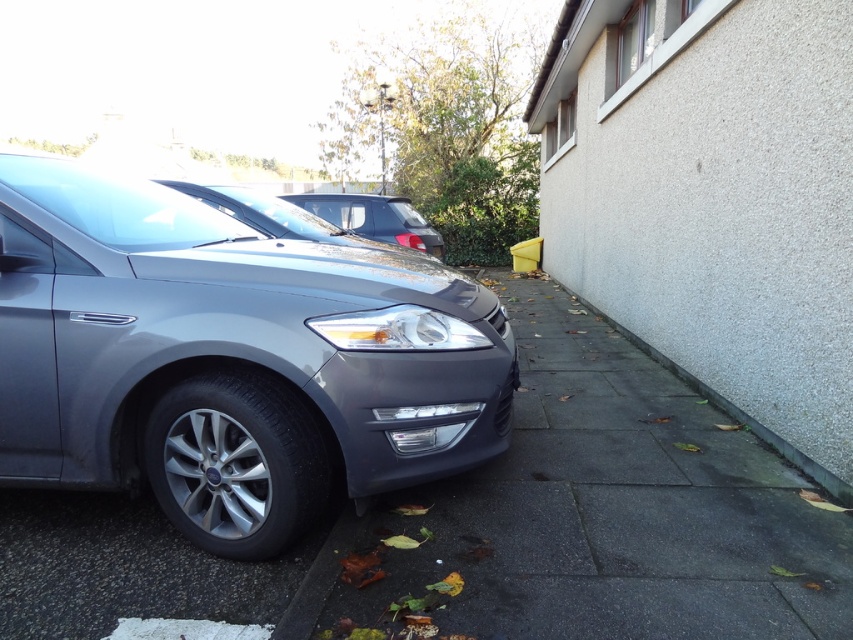
Can you confirm if satin metallic car at left is thinner than gray concrete curb at lower right?

No, satin metallic car at left is not thinner than gray concrete curb at lower right.

Identify the location of satin metallic car at left. The width and height of the screenshot is (853, 640). click(229, 358).

Identify the location of satin metallic car at left. The height and width of the screenshot is (640, 853). (229, 358).

Between gray concrete pavement at center and satin black minivan at center, which one has less height?

Standing shorter between the two is gray concrete pavement at center.

Locate an element on the screen. The height and width of the screenshot is (640, 853). gray concrete pavement at center is located at coordinates (595, 515).

This screenshot has width=853, height=640. I want to click on gray concrete pavement at center, so click(595, 515).

Is satin metallic car at left above gray concrete pavement at center?

Correct, satin metallic car at left is located above gray concrete pavement at center.

Does satin metallic car at left have a greater height compared to gray concrete pavement at center?

Yes.

Which is behind, point (172, 474) or point (798, 532)?

Point (798, 532)

Image resolution: width=853 pixels, height=640 pixels. I want to click on satin metallic car at left, so click(229, 358).